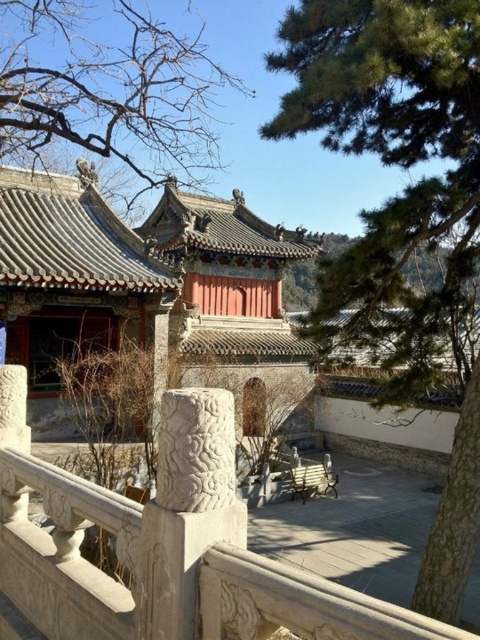
You are a tourist standing in the courtyard and want to take a photo of the matte gray stone palace at center. However, there is a white stone balustrade at center in your way. Can you see the palace clearly through the balustrade?

The white stone balustrade at center is behind the matte gray stone palace at center, so you can see the palace clearly without obstruction from the balustrade.

You are a tourist visiting this historical site and want to take a photo of the matte gray stone palace at center from the white stone balustrade at center. Can you stand on the balustrade to get a better view?

The matte gray stone palace at center is located above the white stone balustrade at center, so standing on the balustrade would allow you to see the palace clearly without obstruction.